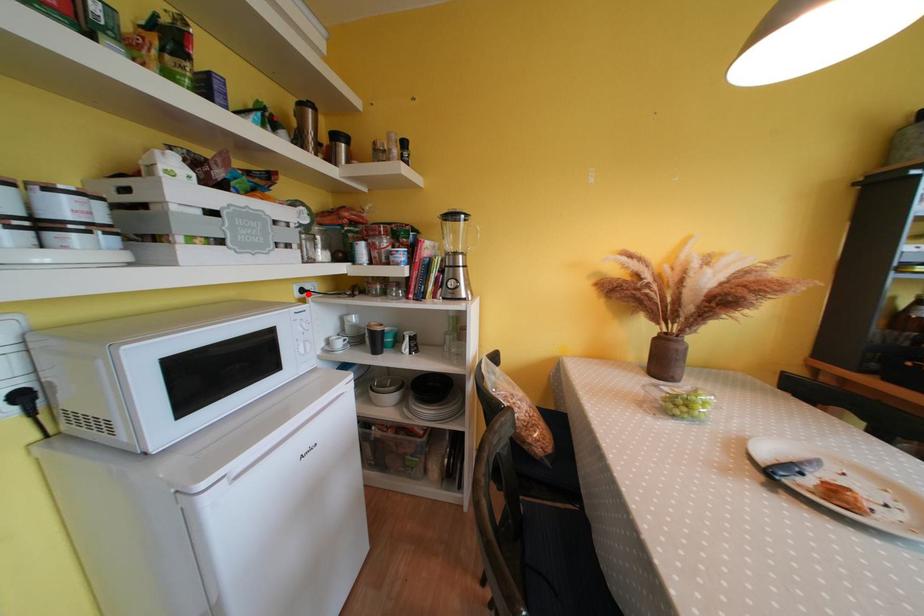
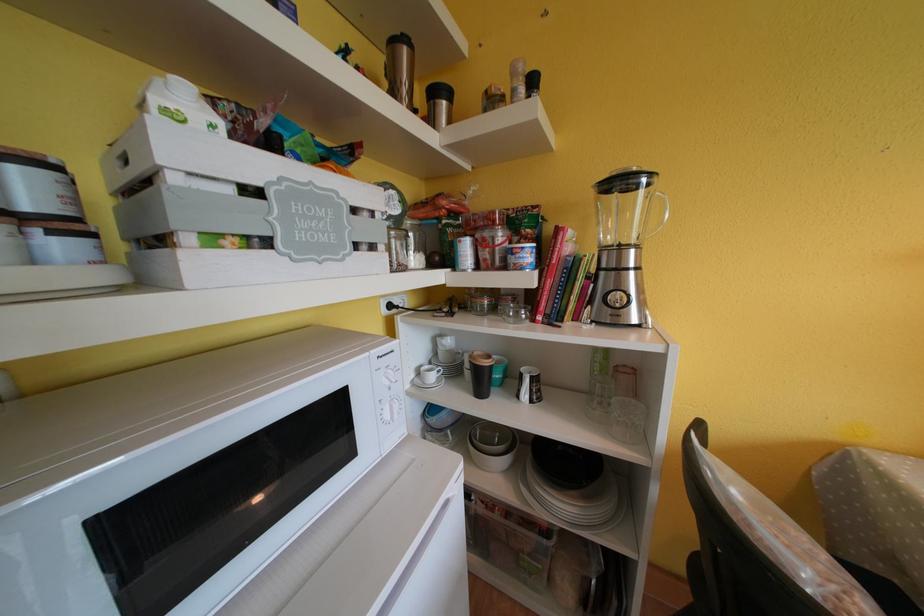
Locate, in the second image, the point that corresponds to the highlighted location in the first image.

(396, 310)